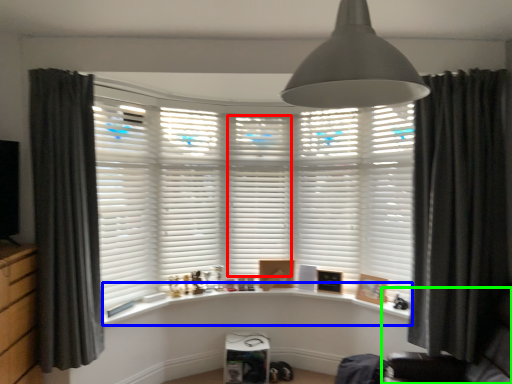
Question: Based on their relative distances, which object is farther from shutter (highlighted by a red box)? Choose from window sill (highlighted by a blue box) and swivel chair (highlighted by a green box).

Choices:
 (A) window sill
 (B) swivel chair

Answer: (B)